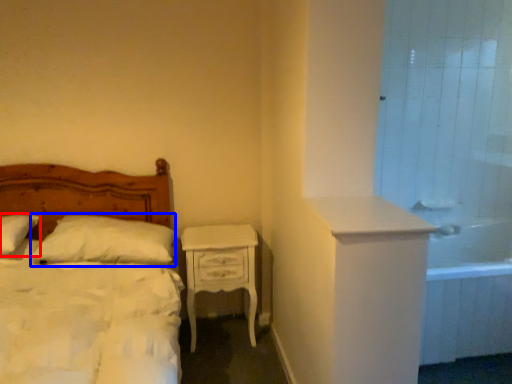
Question: Which object is closer to the camera taking this photo, pillow (highlighted by a red box) or pillow (highlighted by a blue box)?

Choices:
 (A) pillow
 (B) pillow

Answer: (A)